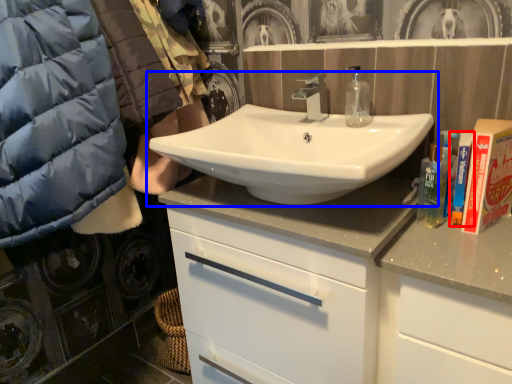
Question: Which object is closer to the camera taking this photo, toiletry (highlighted by a red box) or sink (highlighted by a blue box)?

Choices:
 (A) toiletry
 (B) sink

Answer: (B)